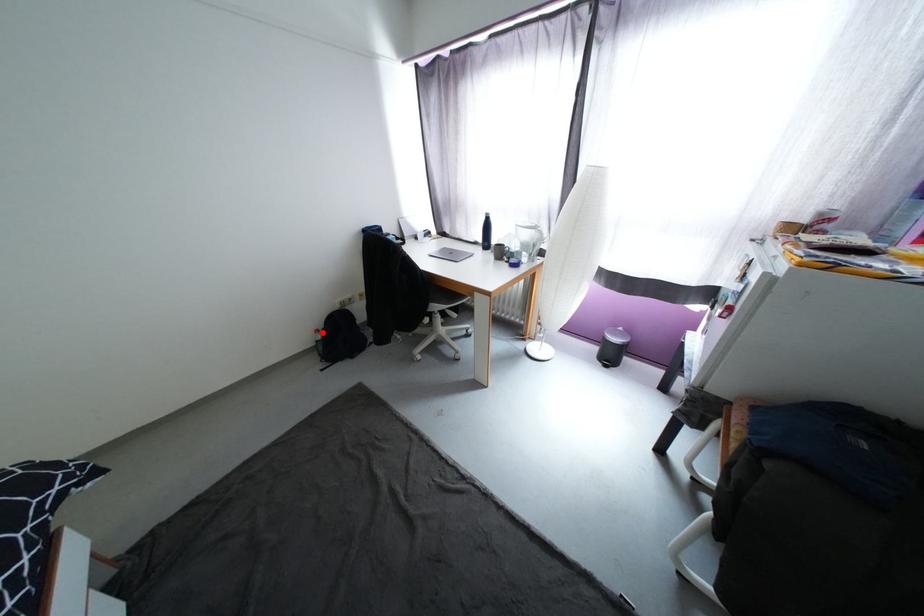
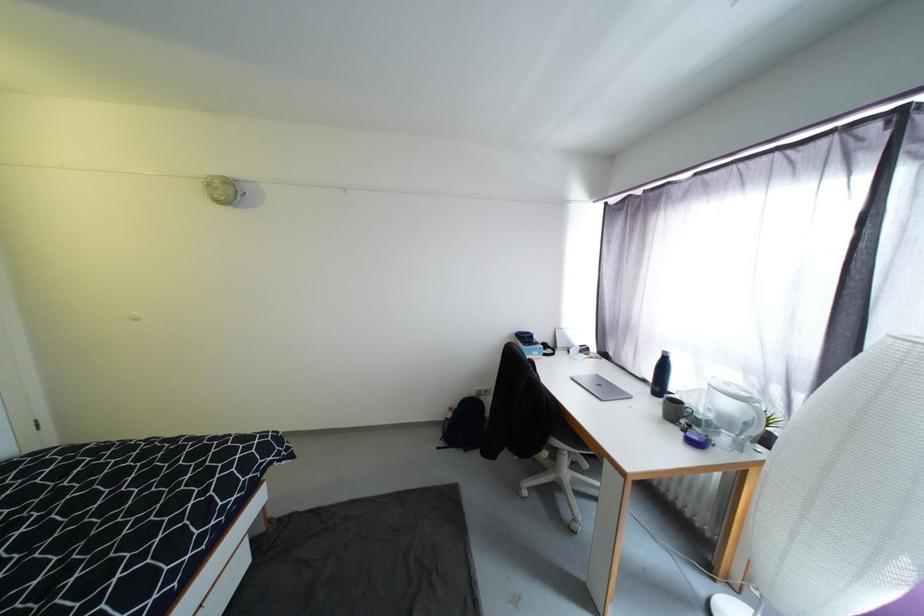
Question: I am providing you with two images of the same scene from different viewpoints. Image1 has a red point marked. In image2, the corresponding 3D location appears at what relative position? Reply with the corresponding letter.

Choices:
 (A) Closer
 (B) Farther

Answer: (B)